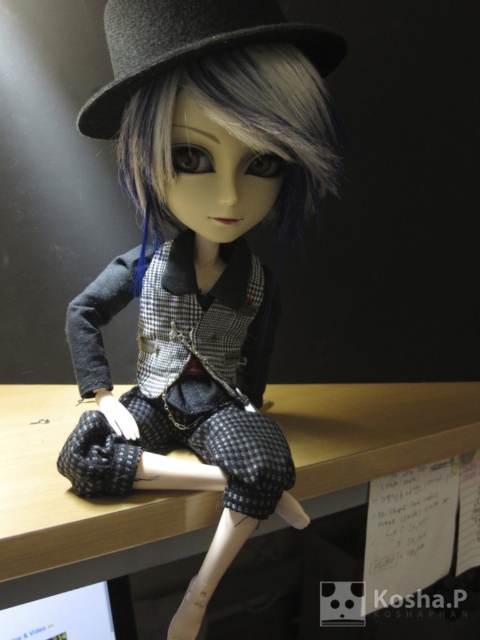
Question: Which of the following is the closest to the observer?

Choices:
 (A) gray matte hair at center
 (B) wooden table at center
 (C) matte black doll at center

Answer: (C)

Question: Does wooden table at center have a larger size compared to gray matte hair at center?

Choices:
 (A) no
 (B) yes

Answer: (B)

Question: Among these objects, which one is nearest to the camera?

Choices:
 (A) gray felt fedora at upper center
 (B) matte black doll at center
 (C) gray matte hair at center

Answer: (A)

Question: Observing the image, what is the correct spatial positioning of matte black doll at center in reference to gray felt fedora at upper center?

Choices:
 (A) below
 (B) above

Answer: (A)

Question: Does matte black doll at center have a greater width compared to gray felt fedora at upper center?

Choices:
 (A) yes
 (B) no

Answer: (A)

Question: Which is farther from the matte black doll at center?

Choices:
 (A) gray matte hair at center
 (B) wooden table at center
 (C) gray felt fedora at upper center

Answer: (B)